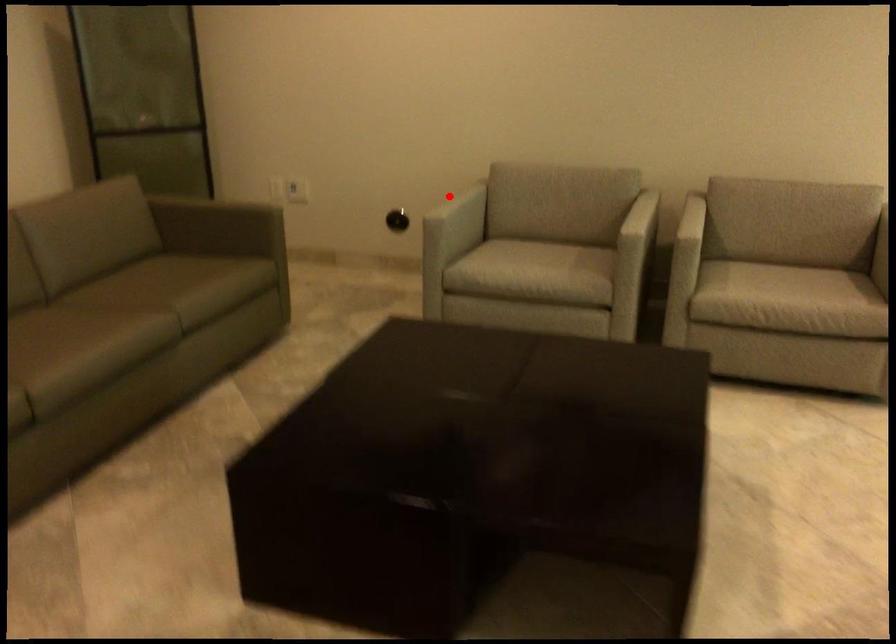
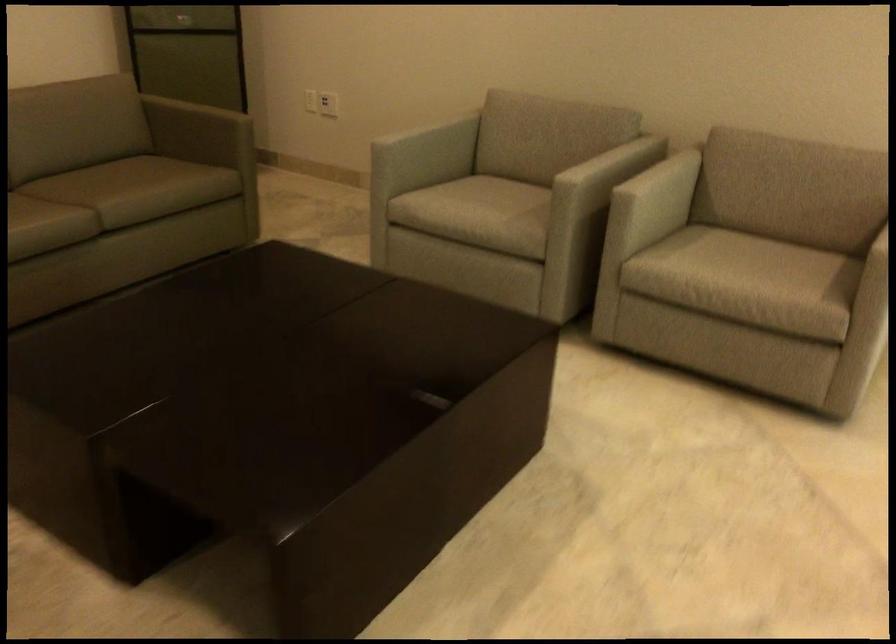
Find the pixel in the second image that matches the highlighted location in the first image.

(423, 127)